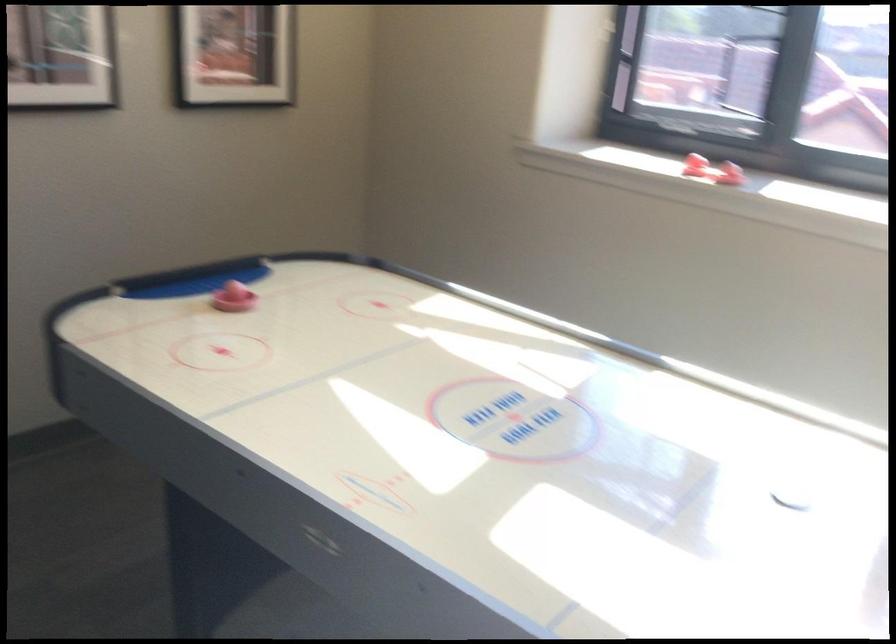
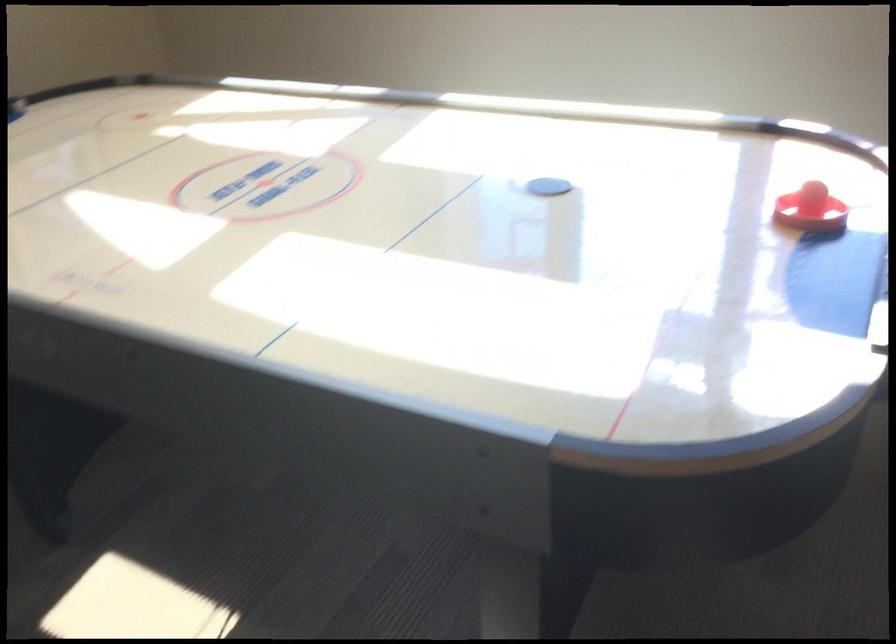
Question: The first image is from the beginning of the video and the second image is from the end. How did the camera likely rotate when shooting the video?

Choices:
 (A) Left
 (B) Right
 (C) Up
 (D) Down

Answer: (D)